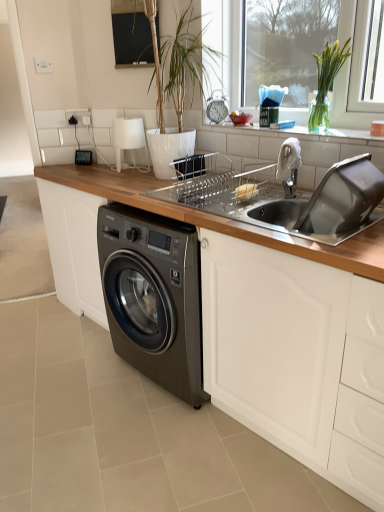
The height and width of the screenshot is (512, 384). What do you see at coordinates (282, 196) in the screenshot? I see `stainless steel sink at upper right` at bounding box center [282, 196].

Identify the location of white glossy window sill at upper center. (293, 133).

Measure the distance between black glass window screen at upper center and camera.

black glass window screen at upper center is 2.13 meters from camera.

What do you see at coordinates (326, 82) in the screenshot? This screenshot has height=512, width=384. I see `green glass vase at upper right` at bounding box center [326, 82].

You are a GUI agent. You are given a task and a screenshot of the screen. Output one action in this format:
    pyautogui.click(x=<x>, y=<y>)
    Task: Click on the wooden at lower left
    
    Given the screenshot: What is the action you would take?
    pyautogui.click(x=218, y=218)

What's the angular difference between black glass window screen at upper center and wooden at lower left's facing directions?

There is a 27.3-degree angle between the facing directions of black glass window screen at upper center and wooden at lower left.

Does black glass window screen at upper center touch wooden at lower left?

black glass window screen at upper center is not next to wooden at lower left, and they're not touching.

From the image's perspective, between black glass window screen at upper center and wooden at lower left, which one is located above?

From the image's view, black glass window screen at upper center is above.

Which object is closer to the camera, black glass window screen at upper center or green glass vase at upper right?

green glass vase at upper right is closer to the camera.

Is black glass window screen at upper center directly adjacent to green glass vase at upper right?

No, black glass window screen at upper center is not in contact with green glass vase at upper right.

Is black glass window screen at upper center thinner than green glass vase at upper right?

Yes.

Considering the positions of objects wooden at lower left and metallic silver clock at center in the image provided, who is more to the right, wooden at lower left or metallic silver clock at center?

metallic silver clock at center is more to the right.

In the scene shown: In terms of height, does wooden at lower left look taller or shorter compared to metallic silver clock at center?

In the image, wooden at lower left appears to be taller than metallic silver clock at center.

Does wooden at lower left have a greater width compared to metallic silver clock at center?

Yes, wooden at lower left is wider than metallic silver clock at center.

Is green glass vase at upper right bigger or smaller than black glass window screen at upper center?

Clearly, green glass vase at upper right is larger in size than black glass window screen at upper center.

Is green glass vase at upper right inside the boundaries of black glass window screen at upper center, or outside?

green glass vase at upper right lies outside black glass window screen at upper center.

In the scene shown: Considering the positions of objects green glass vase at upper right and black glass window screen at upper center in the image provided, who is more to the left, green glass vase at upper right or black glass window screen at upper center?

Positioned to the left is black glass window screen at upper center.

Between green glass vase at upper right and black glass window screen at upper center, which one has larger width?

green glass vase at upper right is wider.

Is silver metallic faucet at upper right not near stainless steel sink at upper right?

No.

How distant is silver metallic faucet at upper right from stainless steel sink at upper right?

They are 9.38 inches apart.

From the image's perspective, is silver metallic faucet at upper right on top of stainless steel sink at upper right?

Yes, from the image's perspective, silver metallic faucet at upper right is above stainless steel sink at upper right.

Looking at the image, does silver metallic faucet at upper right seem bigger or smaller compared to stainless steel sink at upper right?

Considering their sizes, silver metallic faucet at upper right takes up less space than stainless steel sink at upper right.

From the image's perspective, is stainless steel sink at upper right positioned above or below black glass window screen at upper center?

stainless steel sink at upper right is below black glass window screen at upper center.

Considering the points (269, 217) and (137, 13), which point is behind, point (269, 217) or point (137, 13)?

The point (137, 13) is farther from the camera.

How many degrees apart are the facing directions of stainless steel sink at upper right and black glass window screen at upper center?

The angular difference between stainless steel sink at upper right and black glass window screen at upper center is 28.1 degrees.

Is stainless steel sink at upper right oriented away from black glass window screen at upper center?

That's not correct — stainless steel sink at upper right is not looking away from black glass window screen at upper center.

From the image's perspective, which one is positioned higher, wooden at lower left or white glossy window sill at upper center?

From the image's view, white glossy window sill at upper center is above.

How distant is wooden at lower left from white glossy window sill at upper center?

A distance of 28.43 inches exists between wooden at lower left and white glossy window sill at upper center.

Who is more distant, wooden at lower left or white glossy window sill at upper center?

white glossy window sill at upper center is more distant.

Based on the photo, from a real-world perspective, is wooden at lower left under white glossy window sill at upper center?

Correct, in the physical world, wooden at lower left is lower than white glossy window sill at upper center.

Identify the location of countertop below the black glass window screen at upper center (from the image's perspective). This screenshot has width=384, height=512. (218, 218).

The height and width of the screenshot is (512, 384). I want to click on plant located on the right of black glass window screen at upper center, so click(326, 82).

Looking at the image, which one is located closer to white glossy window sill at upper center, silver metallic faucet at upper right or green glass vase at upper right?

Among the two, green glass vase at upper right is located nearer to white glossy window sill at upper center.

Considering their positions, is wooden at lower left positioned further to stainless steel sink at upper right than metallic silver clock at center?

The object further to stainless steel sink at upper right is metallic silver clock at center.

Which object lies further to the anchor point metallic silver clock at center, black glass window screen at upper center or stainless steel sink at upper right?

stainless steel sink at upper right lies further to metallic silver clock at center than the other object.

Looking at this image, considering their positions, is green glass vase at upper right positioned further to silver metallic faucet at upper right than wooden at lower left?

wooden at lower left.

When comparing their distances from stainless steel sink at upper right, does wooden at lower left or black glass window screen at upper center seem further?

black glass window screen at upper center lies further to stainless steel sink at upper right than the other object.

Which object lies further to the anchor point wooden at lower left, green glass vase at upper right or black glass window screen at upper center?

green glass vase at upper right.

Looking at this image, which object lies further to the anchor point black glass window screen at upper center, green glass vase at upper right or silver metallic faucet at upper right?

silver metallic faucet at upper right is positioned further to the anchor black glass window screen at upper center.

Based on their spatial positions, is silver metallic faucet at upper right or metallic silver clock at center closer to white glossy window sill at upper center?

silver metallic faucet at upper right is positioned closer to the anchor white glossy window sill at upper center.

I want to click on window sill between black glass window screen at upper center and green glass vase at upper right, so click(293, 133).

I want to click on faucet between black glass window screen at upper center and stainless steel sink at upper right from top to bottom, so click(x=291, y=165).

You are a GUI agent. You are given a task and a screenshot of the screen. Output one action in this format:
    pyautogui.click(x=<x>, y=<y>)
    Task: Click on the faucet between green glass vase at upper right and stainless steel sink at upper right vertically
    The image size is (384, 512).
    Given the screenshot: What is the action you would take?
    pyautogui.click(x=291, y=165)

Find the location of a particular element. appliance between black glass window screen at upper center and green glass vase at upper right in the horizontal direction is located at coordinates (217, 106).